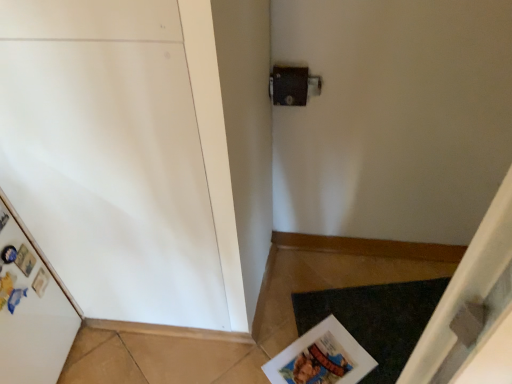
Image resolution: width=512 pixels, height=384 pixels. I want to click on free space above dark gray carpet at lower right (from a real-world perspective), so click(x=376, y=322).